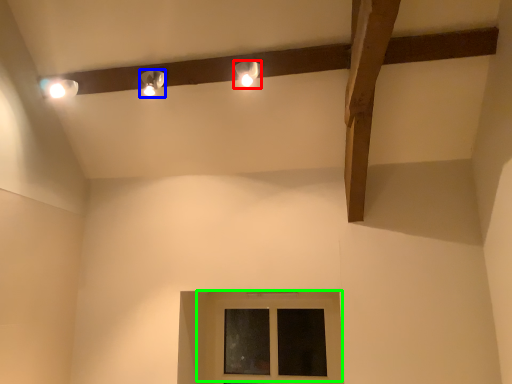
Question: Which object is the farthest from lamp (highlighted by a red box)? Choose among these: lamp (highlighted by a blue box) or window (highlighted by a green box).

Choices:
 (A) lamp
 (B) window

Answer: (B)